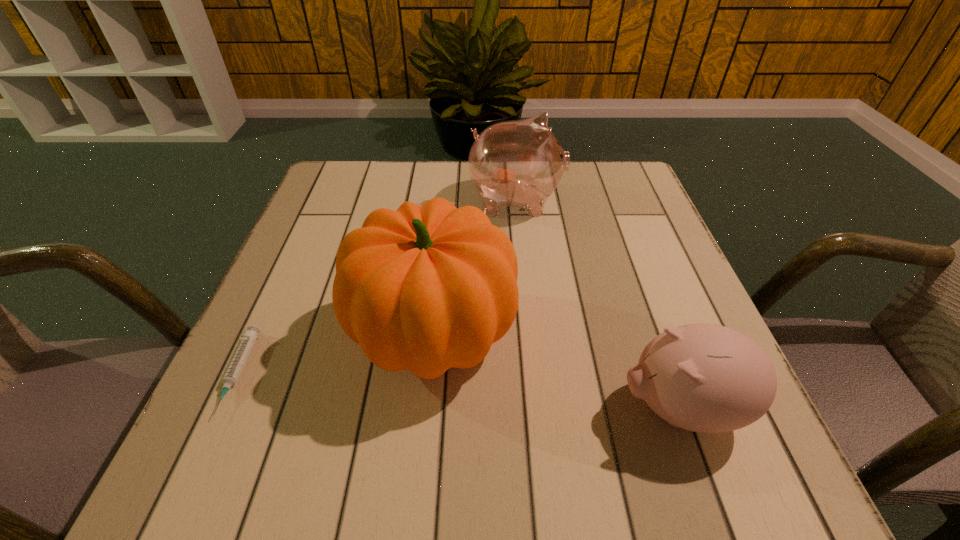
Find the location of `object that stands as the second closest to the farthest object`. object that stands as the second closest to the farthest object is located at coordinates [707, 378].

Select which object appears as the second closest to the shorter piggy bank. Please provide its 2D coordinates. Your answer should be formatted as a tuple, i.e. [(x, y)], where the tuple contains the x and y coordinates of a point satisfying the conditions above.

[(519, 163)]